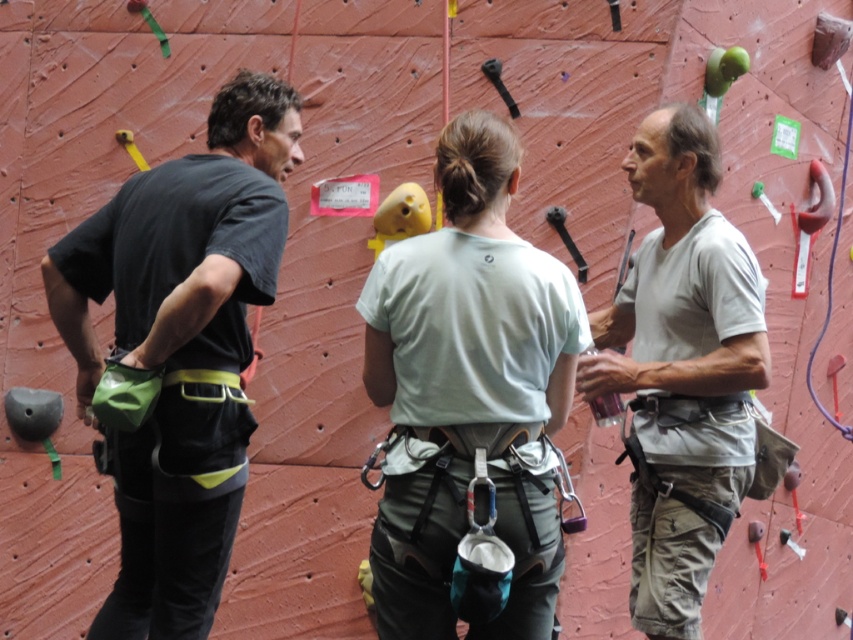
You are a photographer trying to capture a closeup of the climbing holds on the red climbing wall. You notice two points marked on the wall at coordinates point (444, 272) and point (685, 225). Which point should you focus on to get the closest possible shot without moving the camera?

Point (444, 272) is closer to the camera than point (685, 225), so focusing on point (444, 272) will allow you to get the closest possible shot without moving the camera.

You are a photographer trying to capture a group photo of the climbers. You want to ensure that the light green fabric shirt at center and the gray cotton shirt at center are both fully visible in the frame. Based on their heights, which shirt should be positioned closer to the back of the group to avoid blocking the other?

The light green fabric shirt at center is shorter than the gray cotton shirt at center. To ensure both are fully visible, the shorter light green fabric shirt at center should be positioned closer to the back so the taller gray cotton shirt at center can be in front without blocking it.